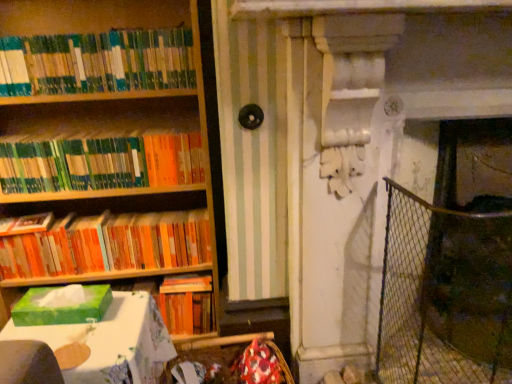
Where is `free spot to the right of green matte tissue box at left`? This screenshot has height=384, width=512. free spot to the right of green matte tissue box at left is located at coordinates (123, 318).